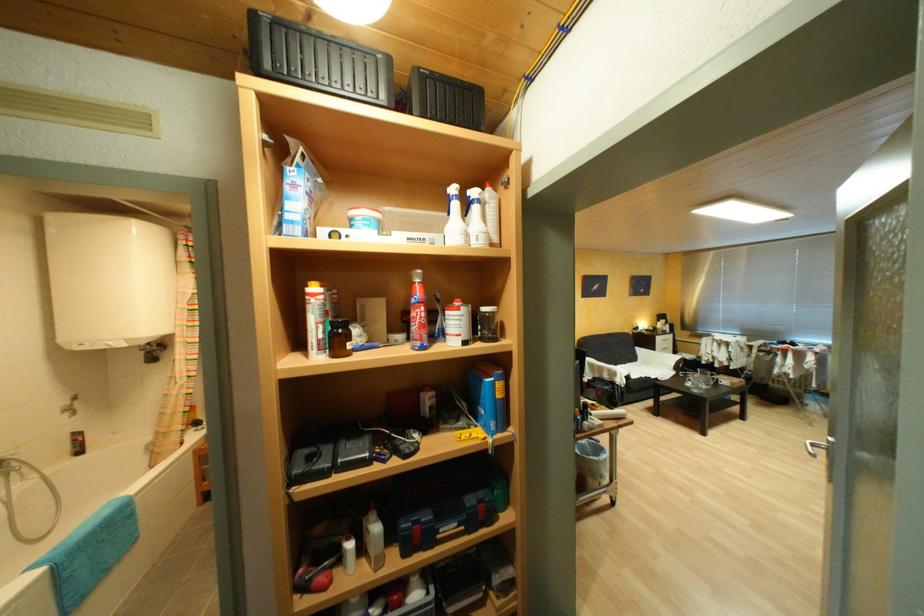
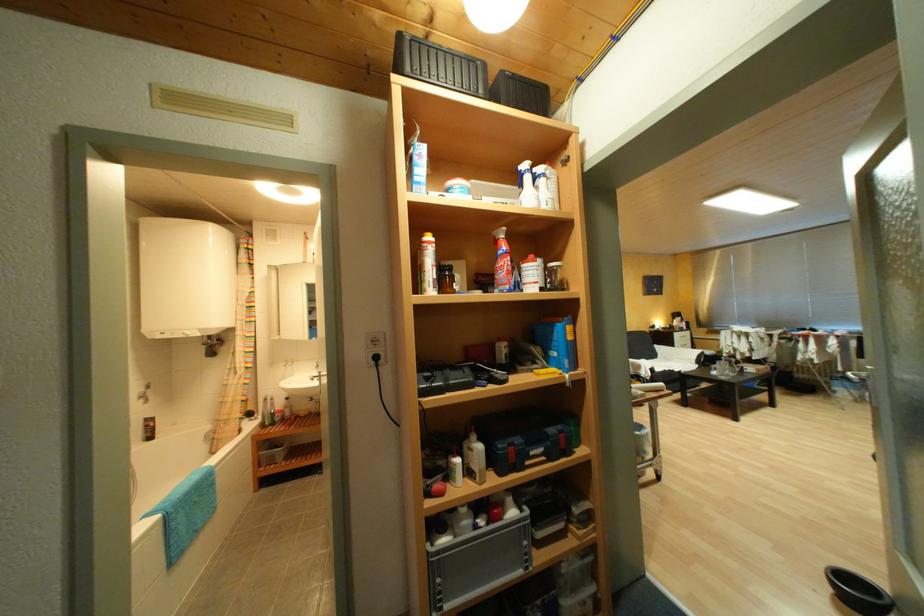
Find the pixel in the second image that matches (x=359, y=546) in the first image.

(467, 461)